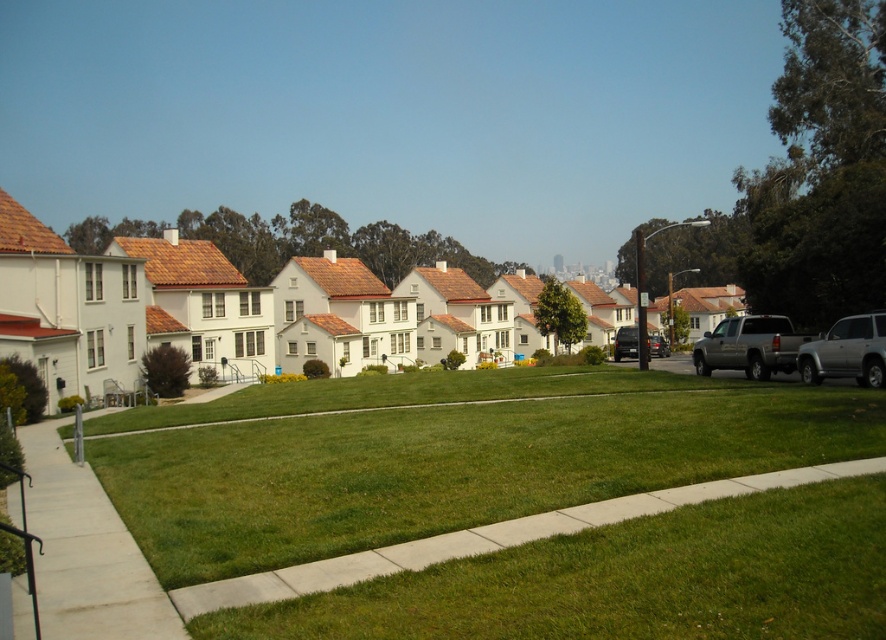
Question: Can you confirm if silver metallic truck at right is positioned below silver metallic suv at right?

Choices:
 (A) yes
 (B) no

Answer: (B)

Question: Which point appears closest to the camera in this image?

Choices:
 (A) (849, 336)
 (B) (106, 412)

Answer: (A)

Question: Which object is the farthest from the silver metallic suv at right?

Choices:
 (A) green smooth lawn at center
 (B) gray concrete sidewalk at lower left

Answer: (B)

Question: In this image, where is green smooth lawn at center located relative to silver metallic truck at right?

Choices:
 (A) left
 (B) right

Answer: (A)

Question: Can you confirm if green smooth lawn at center is wider than silver metallic suv at right?

Choices:
 (A) yes
 (B) no

Answer: (A)

Question: Which object appears closest to the camera in this image?

Choices:
 (A) silver metallic truck at right
 (B) silver metallic suv at right
 (C) green smooth lawn at center

Answer: (C)